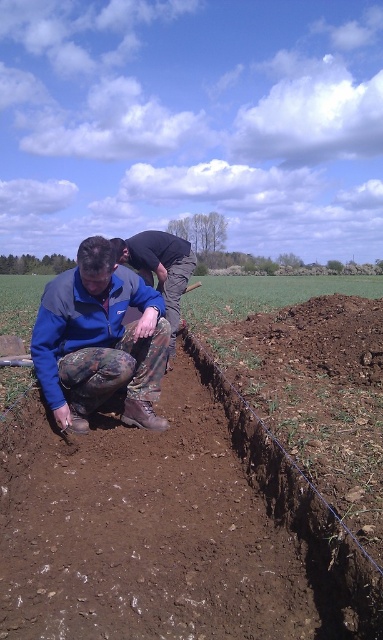
Does camouflage pants at lower center appear under blue camouflage pants at center?

Yes.

Which is above, camouflage pants at lower center or blue camouflage pants at center?

Positioned higher is blue camouflage pants at center.

Between point (134, 358) and point (168, 243), which one is positioned behind?

Positioned behind is point (168, 243).

Identify the location of camouflage pants at lower center. (99, 340).

Between brown soil at center and camouflage pants at lower center, which one is positioned lower?

camouflage pants at lower center is lower down.

Who is higher up, brown soil at center or camouflage pants at lower center?

brown soil at center is above.

Measure the distance between brown soil at center and camera.

brown soil at center and camera are 5.92 feet apart from each other.

Locate an element on the screen. brown soil at center is located at coordinates (170, 529).

Does brown soil at center have a smaller size compared to blue camouflage pants at center?

No, brown soil at center is not smaller than blue camouflage pants at center.

Can you confirm if brown soil at center is bigger than blue camouflage pants at center?

Indeed, brown soil at center has a larger size compared to blue camouflage pants at center.

Where is `brown soil at center`? The image size is (383, 640). brown soil at center is located at coordinates (170, 529).